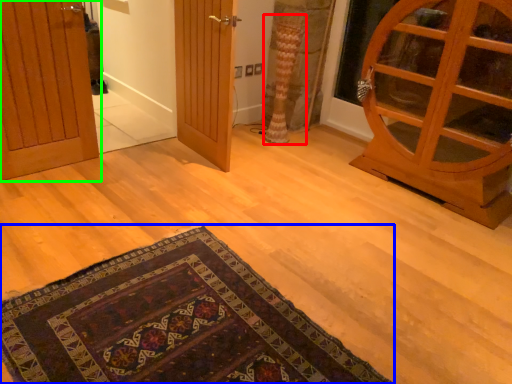
Question: Based on their relative distances, which object is nearer to curtain (highlighted by a red box)? Choose from mat (highlighted by a blue box) and door (highlighted by a green box).

Choices:
 (A) mat
 (B) door

Answer: (B)